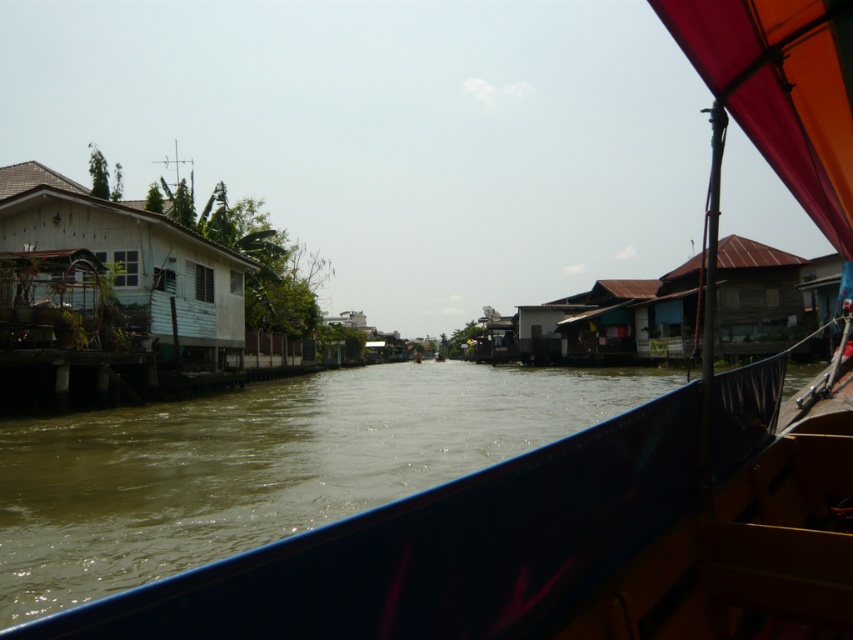
You are a tourist standing on the deck of the boat with a dark blue hull and red canopy. You want to take a photo of the brown wooden hut at right while avoiding the brown murky water at center from appearing too large in the frame. Which object should you move closer to or farther from to achieve this?

To avoid the brown murky water at center appearing too large in the frame, you should move closer to the brown wooden hut at right. Since the brown murky water at center has a lesser height compared to the brown wooden hut at right, moving closer to the hut will reduce the relative size of the water in the photo.

You are a photographer planning to capture the brown murky water at center and the white weathered wood house at left in a single frame. Based on their spatial relationship, which object should you focus on first to ensure both are in the frame without cropping?

The white weathered wood house at left occupies more space in the image than the brown murky water at center, so you should focus on the white weathered wood house at left first to ensure both fit within the frame.

You are standing on the boat with a dark blue hull and a red canopy structure. You notice a point marked at coordinates (437, 548). What is located at that point?

The point at coordinates (437, 548) corresponds to brown murky water at center.